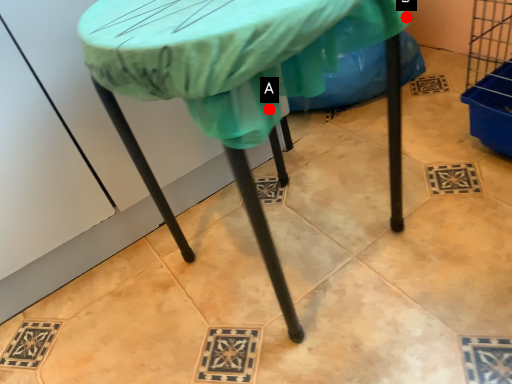
Question: Two points are circled on the image, labeled by A and B beside each circle. Which point is further to the camera?

Choices:
 (A) A is further
 (B) B is further

Answer: (B)